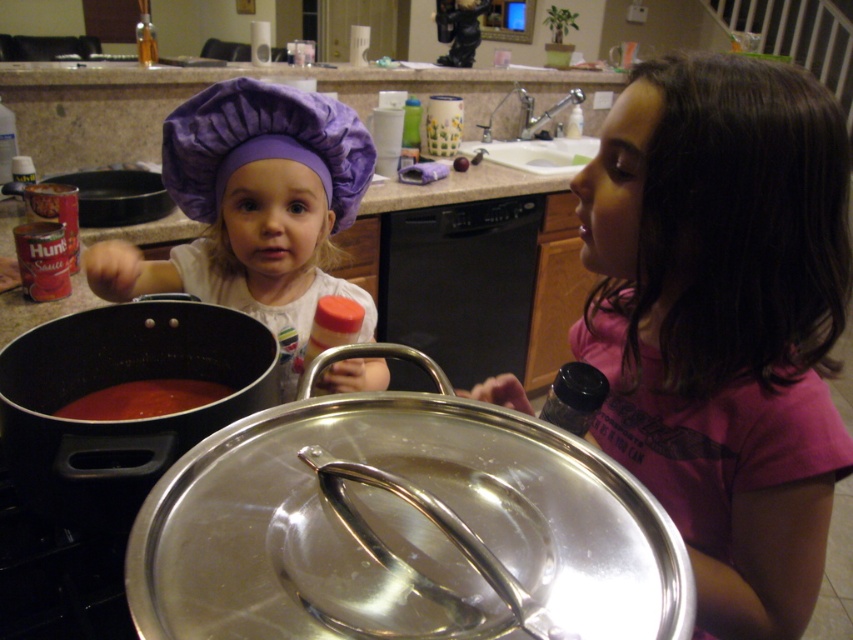
You are standing in the kitchen and want to hand a recipe card to the child wearing the pink fabric shirt at upper right. If your outstretched hand can reach 50 centimeters, will you be able to reach them?

The pink fabric shirt at upper right and viewer are 61.07 centimeters apart from each other, which is beyond the 50 centimeter reach of your outstretched hand. You will not be able to reach them.

Consider the image. You are a delivery robot standing at the point labeled as point (x=515, y=388). You need to deliver a package to the kitchen counter. The counter is 36 inches away from the camera. Can you reach the counter from your current position?

The distance between point (x=515, y=388) and the camera is 34.53 inches. Since the counter is 36 inches away from the camera, you are closer to the counter than the camera. Therefore, you can reach the counter from your current position.

Looking at this image, you are a parent observing the kitchen scene. You need to locate the pink fabric shirt at upper right and the purple fabric chef hat at upper left. According to the scene, which object is positioned higher?

The purple fabric chef hat at upper left is positioned higher than the pink fabric shirt at upper right because the pink fabric shirt at upper right is located below it.